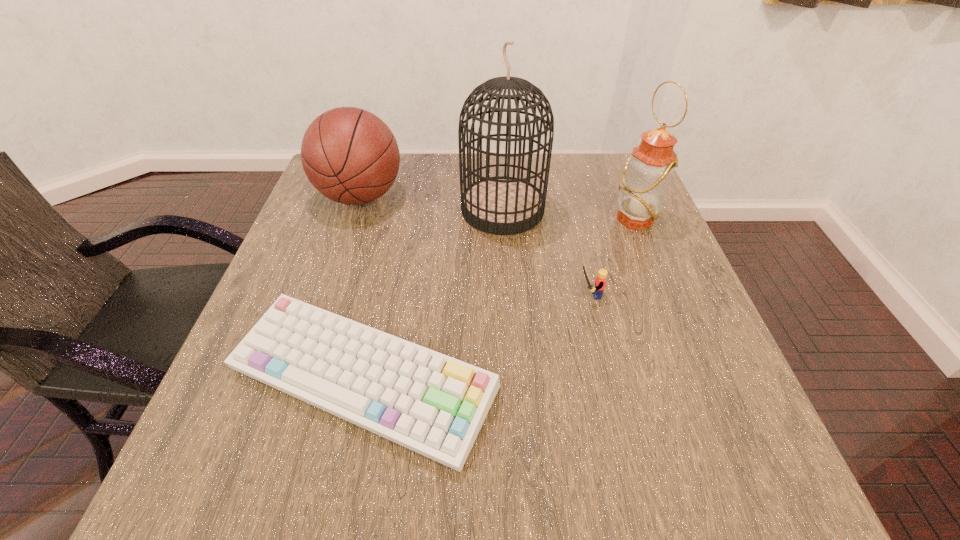
At what (x,y) coordinates should I click in order to perform the action: click on object that is at the right edge. Please return your answer as a coordinate pair (x, y). Looking at the image, I should click on (647, 174).

The height and width of the screenshot is (540, 960). I want to click on object situated at the far left corner, so click(x=349, y=155).

This screenshot has width=960, height=540. I want to click on object at the near left corner, so click(x=433, y=404).

Identify the location of vacant region at the far edge of the desktop. (403, 168).

In the image, there is a desktop. Where is `vacant area at the near edge`? The width and height of the screenshot is (960, 540). vacant area at the near edge is located at coordinates (315, 495).

Locate an element on the screen. vacant space at the left edge of the desktop is located at coordinates (282, 271).

Where is `vacant space at the right edge`? The image size is (960, 540). vacant space at the right edge is located at coordinates (x=630, y=231).

In order to click on vacant area at the near left corner of the desktop in this screenshot , I will do [208, 456].

The image size is (960, 540). Identify the location of free space between the basketball and the birdcage. (432, 203).

Where is `vacant point located between the basketball and the birdcage`? This screenshot has width=960, height=540. vacant point located between the basketball and the birdcage is located at coordinates (432, 203).